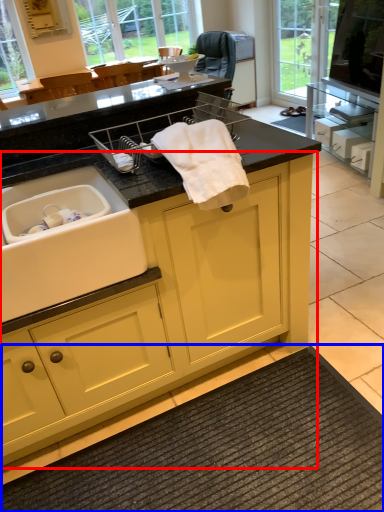
Question: Which point is closer to the camera, cabinetry (highlighted by a red box) or bath mat (highlighted by a blue box)?

Choices:
 (A) cabinetry
 (B) bath mat

Answer: (A)